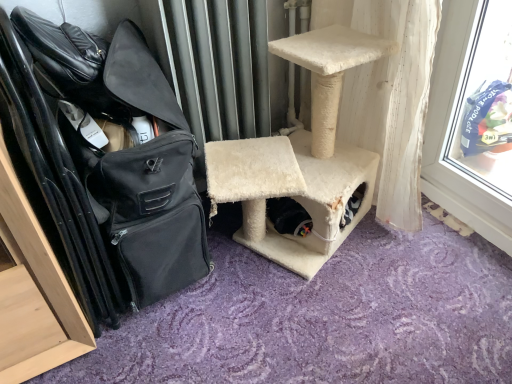
At what (x,y) coordinates should I click in order to perform the action: click on vacant area that is situated to the right of beige carpeted cat tree at center. Please return your answer as a coordinate pair (x, y). The width and height of the screenshot is (512, 384). Looking at the image, I should click on (435, 261).